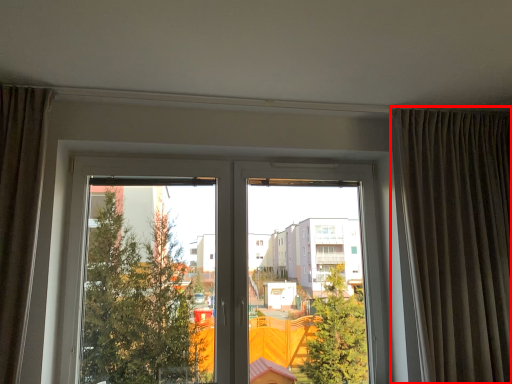
Question: From the image's perspective, considering the relative positions of curtain (annotated by the red box) and window in the image provided, where is curtain (annotated by the red box) located with respect to the staircase?

Choices:
 (A) below
 (B) above

Answer: (B)